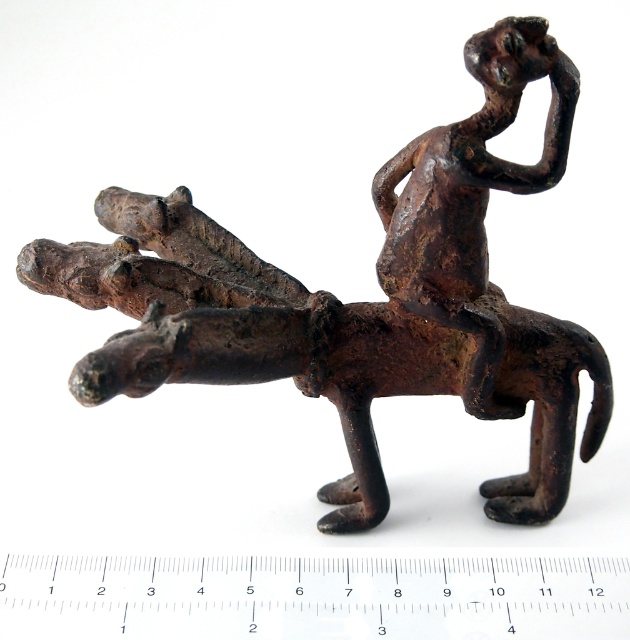
Who is positioned more to the right, metallic ruler at center or rusty metal figure at upper right?

rusty metal figure at upper right

Is point (164, 600) more distant than point (428, 264)?

Yes, point (164, 600) is farther from viewer.

Locate an element on the screen. The width and height of the screenshot is (630, 640). metallic ruler at center is located at coordinates (312, 596).